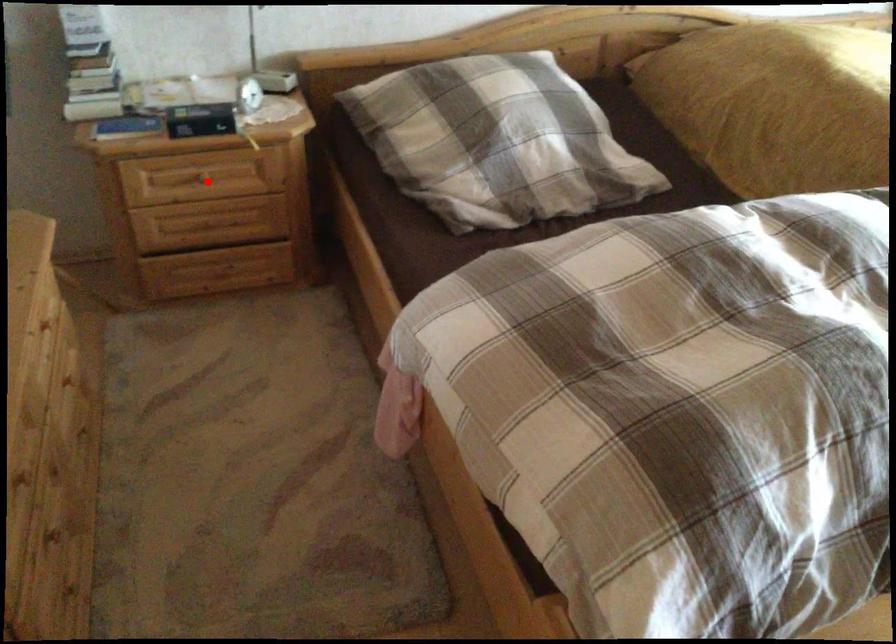
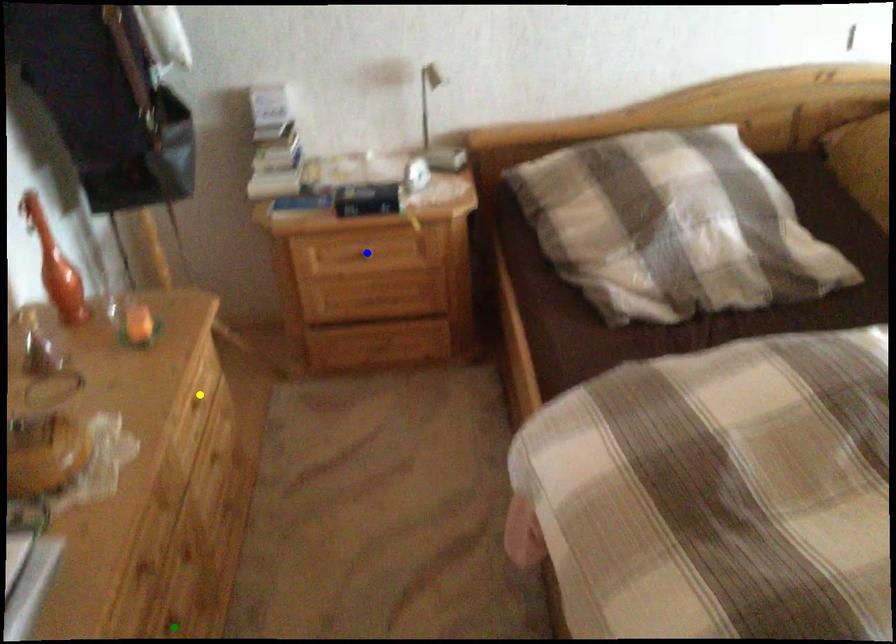
Question: I am providing you with two images of the same scene from different viewpoints. A red point is marked on the first image. You are given multiple points on the second image. In image 2, which mark is for the same physical point as the one in image 1?

Choices:
 (A) yellow point
 (B) green point
 (C) blue point

Answer: (C)